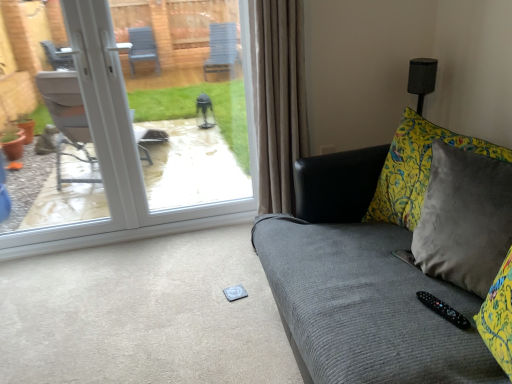
Question: Is velvet gray couch at right closer to the viewer compared to black plastic remote at lower right?

Choices:
 (A) yes
 (B) no

Answer: (A)

Question: From the image's perspective, is velvet gray couch at right under black plastic remote at lower right?

Choices:
 (A) no
 (B) yes

Answer: (A)

Question: Does velvet gray couch at right have a greater height compared to black plastic remote at lower right?

Choices:
 (A) no
 (B) yes

Answer: (B)

Question: Is velvet gray couch at right to the left of black plastic remote at lower right from the viewer's perspective?

Choices:
 (A) no
 (B) yes

Answer: (B)

Question: Does velvet gray couch at right turn towards black plastic remote at lower right?

Choices:
 (A) yes
 (B) no

Answer: (B)

Question: Is velvet gray couch at right wider or thinner than white plastic door at upper left?

Choices:
 (A) thin
 (B) wide

Answer: (B)

Question: In terms of size, does velvet gray couch at right appear bigger or smaller than white plastic door at upper left?

Choices:
 (A) big
 (B) small

Answer: (A)

Question: From the image's perspective, is velvet gray couch at right located above or below white plastic door at upper left?

Choices:
 (A) below
 (B) above

Answer: (A)

Question: Is point (365, 210) positioned closer to the camera than point (100, 107)?

Choices:
 (A) closer
 (B) farther

Answer: (A)

Question: In terms of width, does white plastic door at upper left look wider or thinner when compared to velvet gray couch at right?

Choices:
 (A) thin
 (B) wide

Answer: (A)

Question: Looking at the image, does white plastic door at upper left seem bigger or smaller compared to velvet gray couch at right?

Choices:
 (A) big
 (B) small

Answer: (B)

Question: Is white plastic door at upper left taller or shorter than velvet gray couch at right?

Choices:
 (A) short
 (B) tall

Answer: (B)

Question: From the image's perspective, is white plastic door at upper left positioned above or below velvet gray couch at right?

Choices:
 (A) above
 (B) below

Answer: (A)

Question: Looking at their shapes, would you say black plastic remote at lower right is wider or thinner than white plastic door at upper left?

Choices:
 (A) wide
 (B) thin

Answer: (B)

Question: Is black plastic remote at lower right taller or shorter than white plastic door at upper left?

Choices:
 (A) tall
 (B) short

Answer: (B)